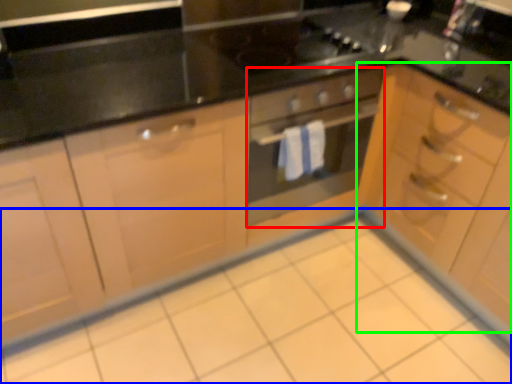
Question: Which object is positioned closest to oven (highlighted by a red box)? Select from ceramic tile (highlighted by a blue box) and cabinetry (highlighted by a green box).

Choices:
 (A) ceramic tile
 (B) cabinetry

Answer: (B)